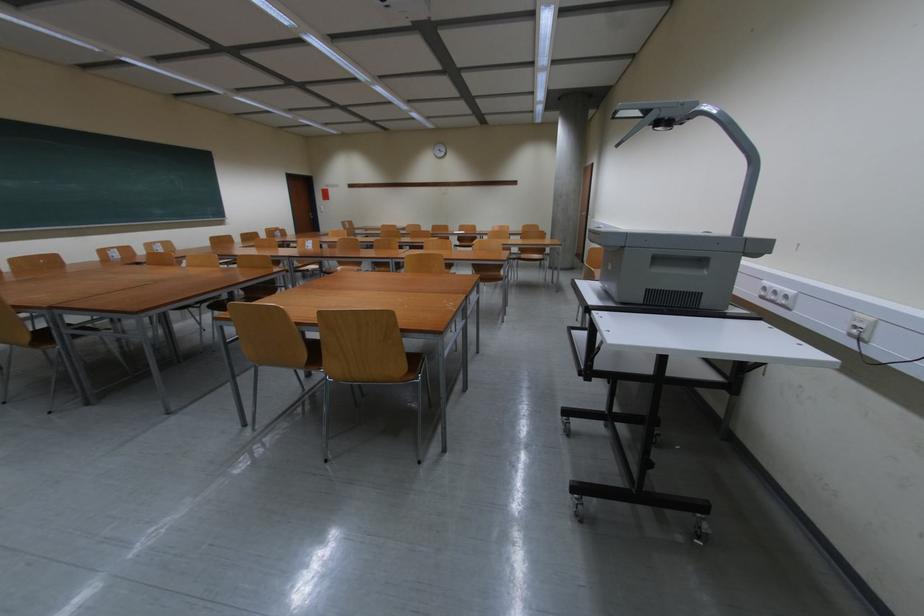
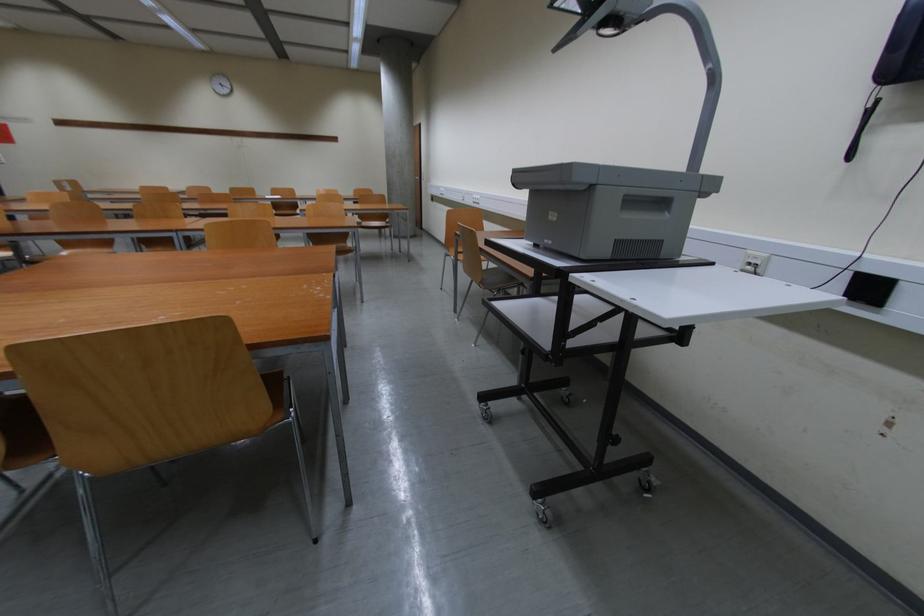
Question: The camera is either moving clockwise (left) or counter-clockwise (right) around the object. The first image is from the beginning of the video and the second image is from the end. Is the camera moving left or right when shooting the video?

Choices:
 (A) Left
 (B) Right

Answer: (A)